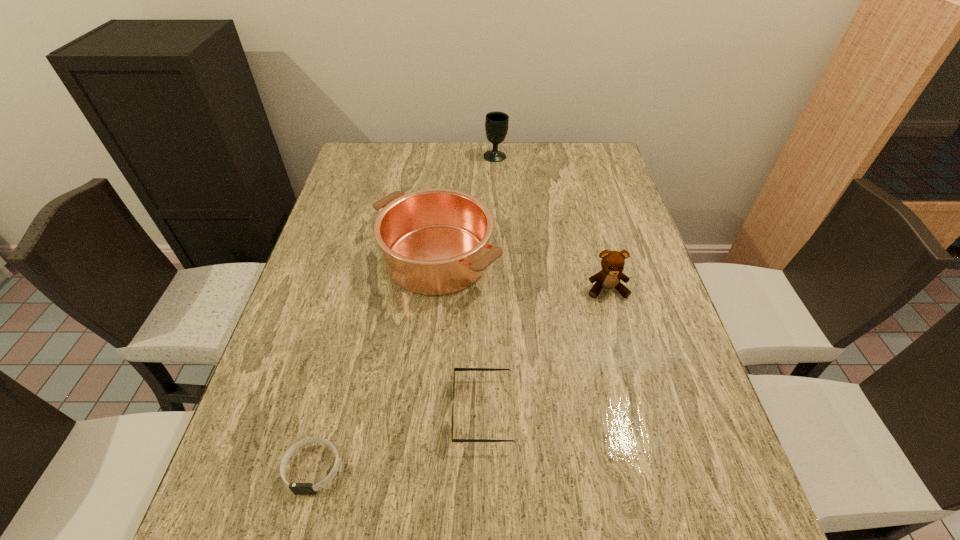
You are a GUI agent. You are given a task and a screenshot of the screen. Output one action in this format:
    pyautogui.click(x=<x>, y=<y>)
    Task: Click on the free space between the teddy bear and the shortest object
    The height and width of the screenshot is (540, 960).
    Given the screenshot: What is the action you would take?
    pyautogui.click(x=460, y=379)

Image resolution: width=960 pixels, height=540 pixels. What are the coordinates of `free space between the teddy bear and the farthest object` in the screenshot? It's located at [x=551, y=222].

At what (x,y) coordinates should I click in order to perform the action: click on vacant point located between the chalice and the fourth tallest object. Please return your answer as a coordinate pair (x, y). The width and height of the screenshot is (960, 540). Looking at the image, I should click on (489, 284).

This screenshot has width=960, height=540. Find the location of `free space between the teddy bear and the saucepan`. free space between the teddy bear and the saucepan is located at coordinates (522, 274).

Locate an element on the screen. This screenshot has height=540, width=960. vacant area between the sunglasses and the saucepan is located at coordinates (460, 335).

What are the coordinates of `vacant space that is in between the sunglasses and the wristband` in the screenshot? It's located at (397, 440).

The image size is (960, 540). What are the coordinates of `free spot between the shortest object and the farthest object` in the screenshot? It's located at (404, 312).

The image size is (960, 540). Identify the location of free point between the saucepan and the wristband. (375, 363).

Identify the location of the closest object to the shortest object. coord(455,369).

You are a GUI agent. You are given a task and a screenshot of the screen. Output one action in this format:
    pyautogui.click(x=<x>, y=<y>)
    Task: Click on the object that is the fourth closest to the chalice
    The image size is (960, 540).
    Given the screenshot: What is the action you would take?
    pyautogui.click(x=297, y=488)